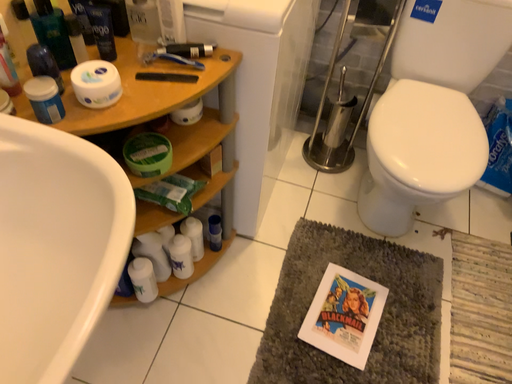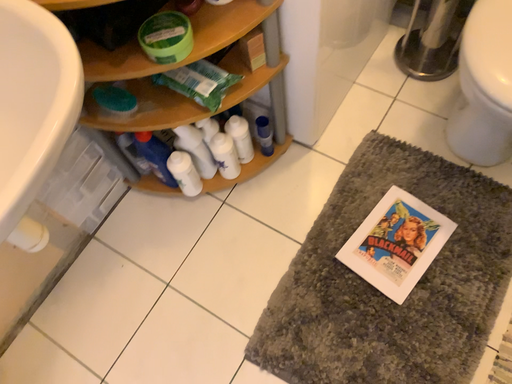
Question: How did the camera likely rotate when shooting the video?

Choices:
 (A) rotated upward
 (B) rotated downward

Answer: (B)